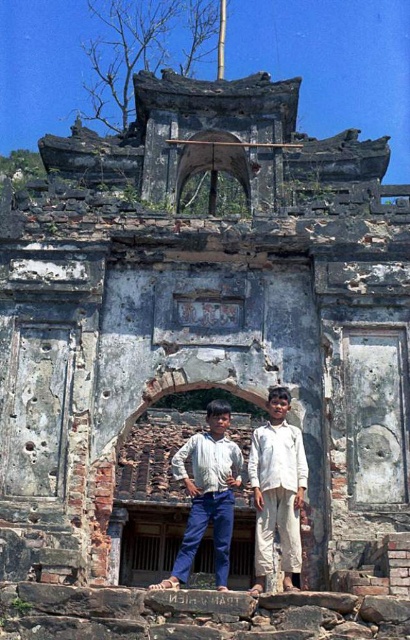
Question: Is white cotton pants at center positioned behind white cotton shirt at center?

Choices:
 (A) yes
 (B) no

Answer: (B)

Question: Which of the following is the farthest from the observer?

Choices:
 (A) white cotton shirt at center
 (B) white cotton pants at center

Answer: (A)

Question: Does white cotton pants at center have a lesser width compared to white cotton shirt at center?

Choices:
 (A) no
 (B) yes

Answer: (A)

Question: Can you confirm if white cotton pants at center is bigger than white cotton shirt at center?

Choices:
 (A) no
 (B) yes

Answer: (B)

Question: Among these points, which one is farthest from the camera?

Choices:
 (A) (188, 531)
 (B) (268, 429)

Answer: (B)